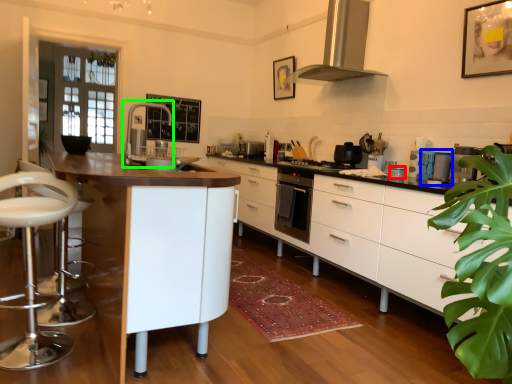
Question: Which object is the farthest from appliance (highlighted by a red box)? Choose among these: appliance (highlighted by a blue box) or faucet (highlighted by a green box).

Choices:
 (A) appliance
 (B) faucet

Answer: (B)